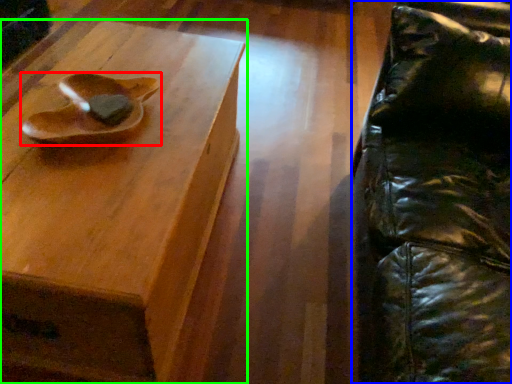
Question: Estimate the real-world distances between objects in this image. Which object is farther from footwear (highlighted by a red box), swivel chair (highlighted by a blue box) or table (highlighted by a green box)?

Choices:
 (A) swivel chair
 (B) table

Answer: (A)